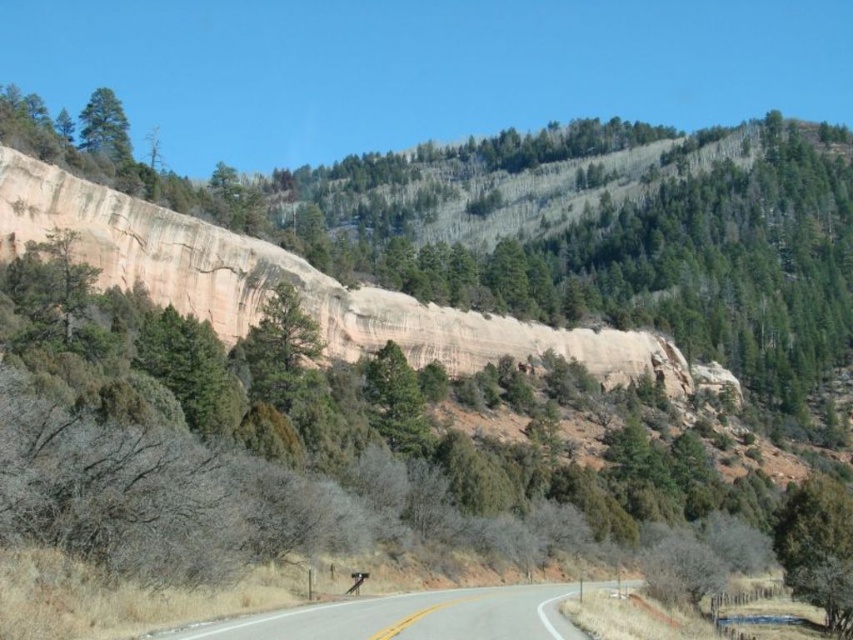
Between smooth asphalt road at center and green matte tree at upper left, which one has less height?

With less height is smooth asphalt road at center.

Is smooth asphalt road at center below green matte tree at upper left?

Yes, smooth asphalt road at center is below green matte tree at upper left.

Does point (300, 612) lie behind point (113, 116)?

No, it is in front of (113, 116).

Where is `smooth asphalt road at center`? The width and height of the screenshot is (853, 640). smooth asphalt road at center is located at coordinates (409, 618).